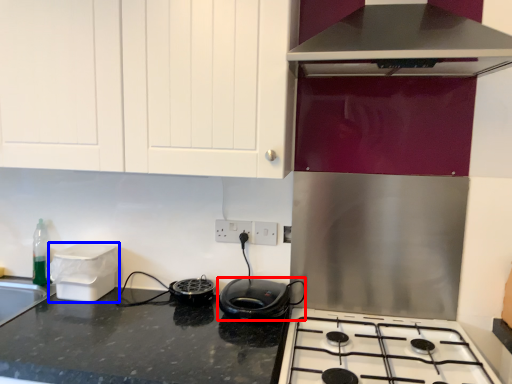
Question: Which point is closer to the camera, kitchen appliance (highlighted by a red box) or appliance (highlighted by a blue box)?

Choices:
 (A) kitchen appliance
 (B) appliance

Answer: (A)